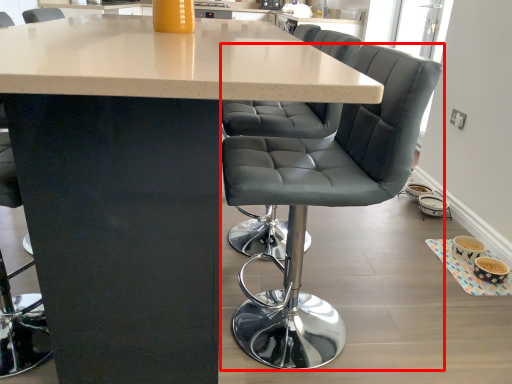
Question: Considering the relative positions of chair (annotated by the red box) and table in the image provided, where is chair (annotated by the red box) located with respect to the staircase?

Choices:
 (A) left
 (B) right

Answer: (B)